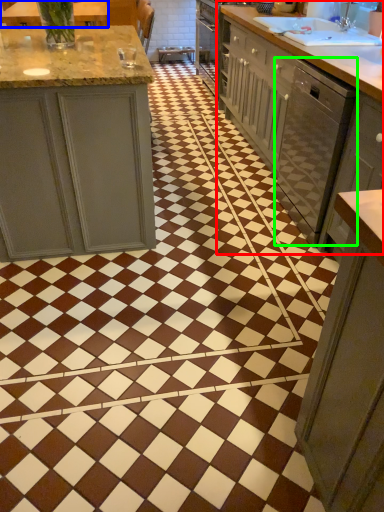
Question: Which is farther away from countertop (highlighted by a red box)? countertop (highlighted by a blue box) or dish washer (highlighted by a green box)?

Choices:
 (A) countertop
 (B) dish washer

Answer: (A)